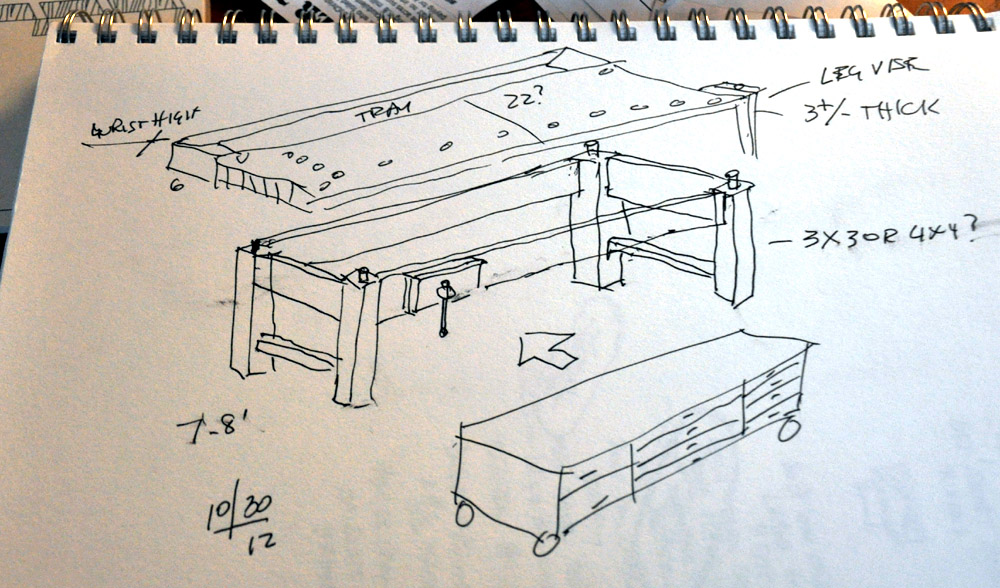
Find the location of `supporting beams`. supporting beams is located at coordinates (676, 259), (299, 343).